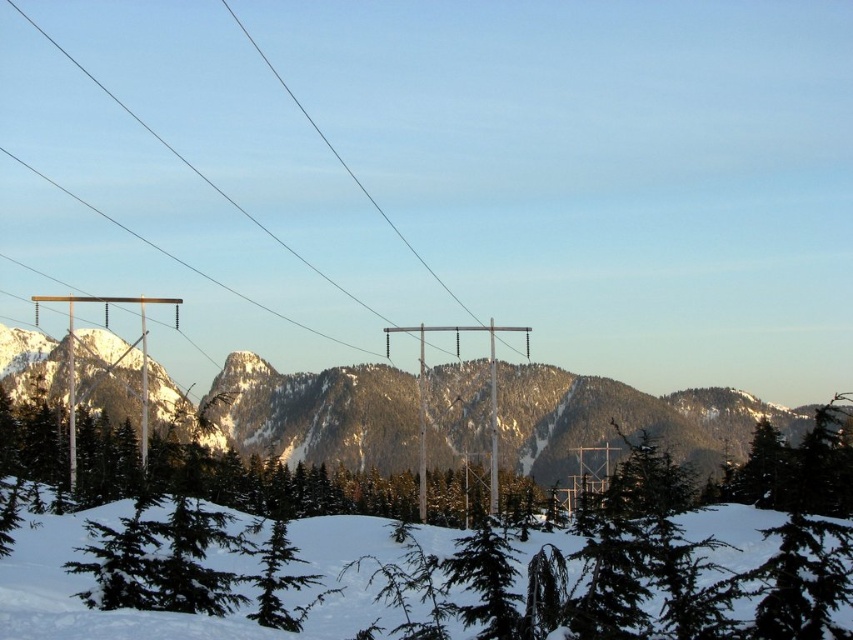
Question: Is white snow at center smaller than green matte tree at center?

Choices:
 (A) no
 (B) yes

Answer: (B)

Question: Can you confirm if white snow at center is smaller than green matte tree at center?

Choices:
 (A) no
 (B) yes

Answer: (B)

Question: Is snowy rock at center thinner than green matte tree at center?

Choices:
 (A) yes
 (B) no

Answer: (B)

Question: Estimate the real-world distances between objects in this image. Which object is farther from the white snow at center?

Choices:
 (A) green matte tree at center
 (B) snowy rock at center

Answer: (B)

Question: Which point appears farthest from the camera in this image?

Choices:
 (A) (3, 637)
 (B) (291, 470)
 (C) (259, 442)

Answer: (C)

Question: Which object is positioned farthest from the green matte tree at center?

Choices:
 (A) white snow at center
 (B) snowy rock at center

Answer: (A)